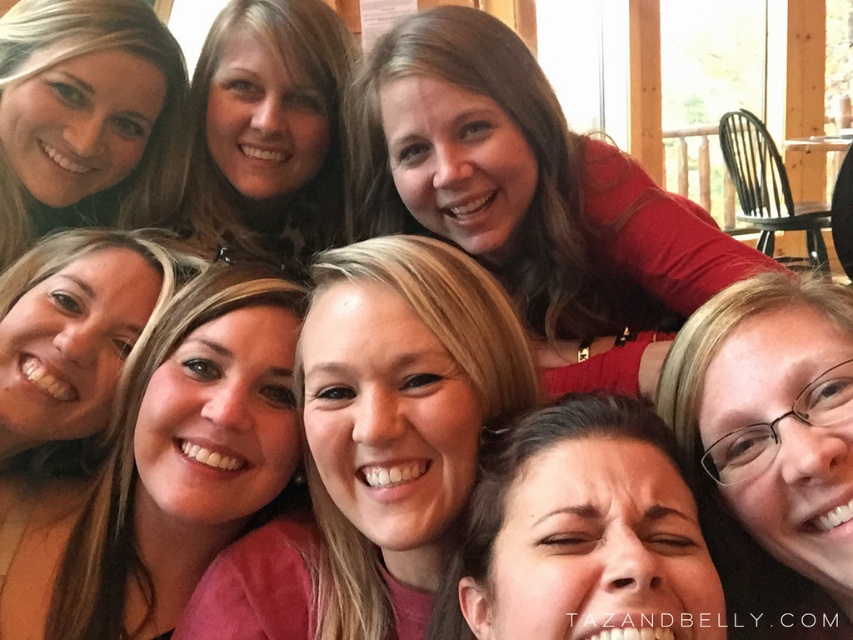
Is matte red shirt at upper center thinner than blonde hair at upper left?

Incorrect, matte red shirt at upper center's width is not less than blonde hair at upper left's.

Looking at this image, is matte red shirt at upper center further to the viewer compared to blonde hair at upper left?

No, it is not.

Who is more forward, (409, 83) or (102, 28)?

Positioned in front is point (409, 83).

Image resolution: width=853 pixels, height=640 pixels. In order to click on matte red shirt at upper center in this screenshot , I will do pyautogui.click(x=527, y=196).

Which of these two, pink matte shirt at center or smooth skin at center, stands shorter?

pink matte shirt at center is shorter.

Who is more distant from viewer, [317,300] or [321,44]?

The point [321,44] is more distant.

Which is behind, point (469, 396) or point (317, 248)?

Positioned behind is point (317, 248).

Identify the location of pink matte shirt at center. The height and width of the screenshot is (640, 853). (375, 445).

Can you confirm if matte red shirt at upper center is smaller than pink matte shirt at center?

No, matte red shirt at upper center is not smaller than pink matte shirt at center.

Between point (563, 164) and point (341, 413), which one is positioned in front?

Point (341, 413)

At what (x,y) coordinates should I click in order to perform the action: click on matte red shirt at upper center. Please return your answer as a coordinate pair (x, y). Image resolution: width=853 pixels, height=640 pixels. Looking at the image, I should click on (527, 196).